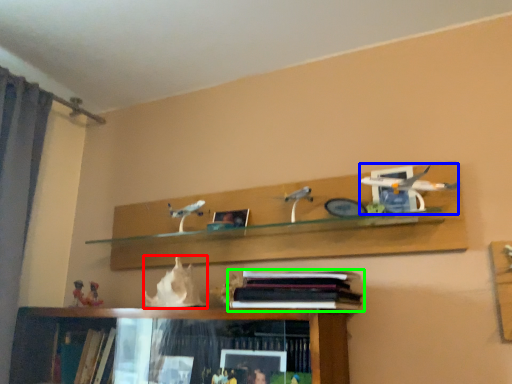
Question: Which object is the closest to the animal (highlighted by a red box)? Choose among these: toy (highlighted by a blue box) or book (highlighted by a green box).

Choices:
 (A) toy
 (B) book

Answer: (B)